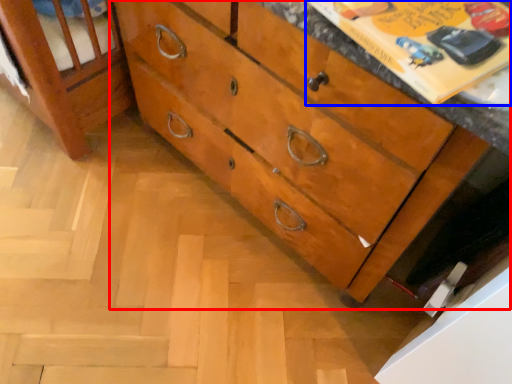
Question: Among these objects, which one is nearest to the camera, chest of drawers (highlighted by a red box) or paperback book (highlighted by a blue box)?

Choices:
 (A) chest of drawers
 (B) paperback book

Answer: (B)